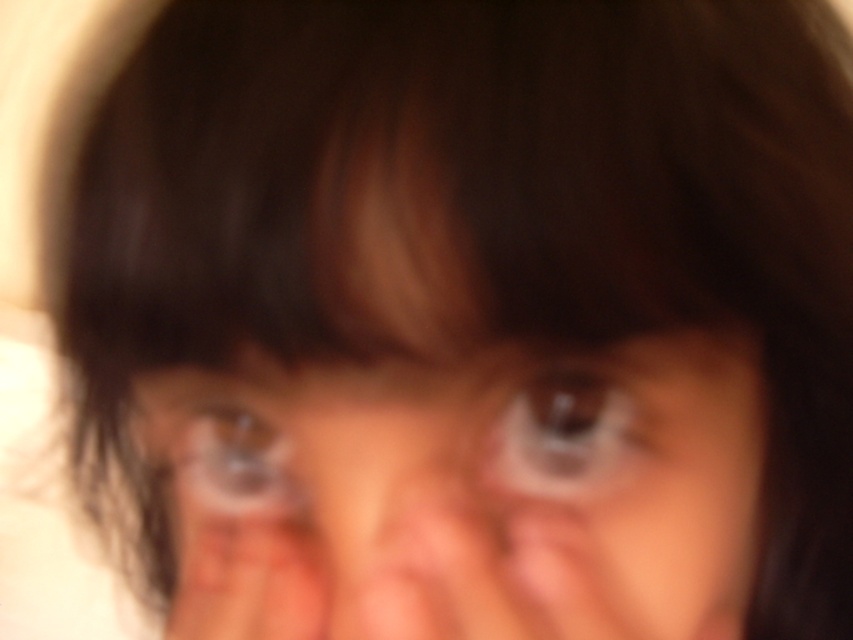
Is point (519, 424) positioned behind point (206, 499)?

No, it is in front of (206, 499).

Who is more forward, [581,435] or [265,444]?

Point [581,435]

Consider the image. Measure the distance between brown glossy eye at center and camera.

The distance of brown glossy eye at center from camera is 22.90 centimeters.

At what (x,y) coordinates should I click in order to perform the action: click on brown glossy eye at center. Please return your answer as a coordinate pair (x, y). Image resolution: width=853 pixels, height=640 pixels. Looking at the image, I should click on (570, 435).

Which is in front, point (633, 492) or point (641, 417)?

Point (641, 417)

Is translucent plastic eyes at center above brown glossy eye at center?

No.

Is point (424, 412) in front of point (520, 465)?

Yes, point (424, 412) is in front of point (520, 465).

Identify the location of translucent plastic eyes at center. (463, 492).

Is point (321, 508) more distant than point (281, 445)?

No.

In the scene shown: Does translucent plastic eyes at center have a smaller size compared to translucent plastic eye at center?

Incorrect, translucent plastic eyes at center is not smaller in size than translucent plastic eye at center.

I want to click on translucent plastic eyes at center, so click(463, 492).

Locate an element on the screen. translucent plastic eyes at center is located at coordinates (463, 492).